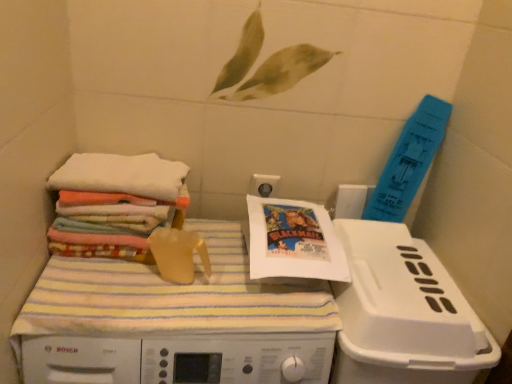
This screenshot has height=384, width=512. I want to click on blank space situated above white paper comic book at center (from a real-world perspective), so click(x=293, y=219).